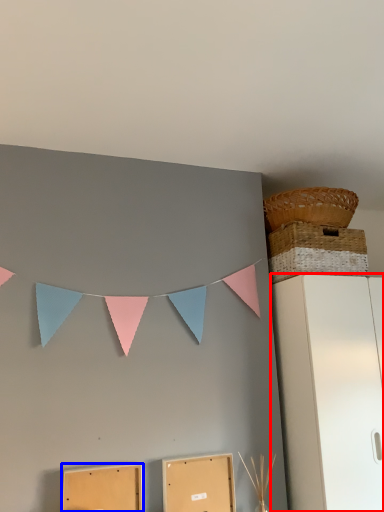
Question: Which of the following is the closest to the observer, furniture (highlighted by a red box) or cardboard box (highlighted by a blue box)?

Choices:
 (A) furniture
 (B) cardboard box

Answer: (B)